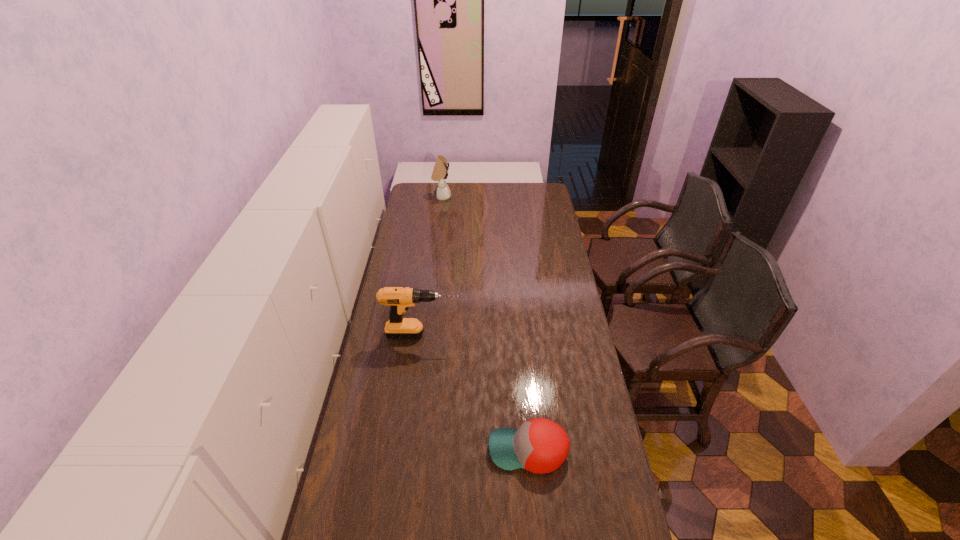
The height and width of the screenshot is (540, 960). Find the location of `doll located in the left edge section of the desktop`. doll located in the left edge section of the desktop is located at coordinates (440, 173).

Find the location of `drill at the left edge`. drill at the left edge is located at coordinates (399, 299).

I want to click on object located at the right edge, so click(540, 445).

You are a GUI agent. You are given a task and a screenshot of the screen. Output one action in this format:
    pyautogui.click(x=<x>, y=<y>)
    Task: Click on the object positioned at the far left corner
    The height and width of the screenshot is (540, 960).
    Given the screenshot: What is the action you would take?
    pyautogui.click(x=440, y=173)

Locate an element on the screen. blank space at the far edge of the desktop is located at coordinates (463, 185).

The height and width of the screenshot is (540, 960). In the image, there is a desktop. Identify the location of vacant space at the left edge. (379, 472).

Image resolution: width=960 pixels, height=540 pixels. Identify the location of vacant area at the right edge. (548, 319).

Where is `vacant region at the far left corner of the desktop`? The image size is (960, 540). vacant region at the far left corner of the desktop is located at coordinates (419, 196).

Locate an element on the screen. free spot between the rightmost object and the farthest object is located at coordinates (485, 324).

You are a GUI agent. You are given a task and a screenshot of the screen. Output one action in this format:
    pyautogui.click(x=<x>, y=<y>)
    Task: Click on the free space between the doll and the second farthest object
    The width and height of the screenshot is (960, 540).
    Given the screenshot: What is the action you would take?
    433,266